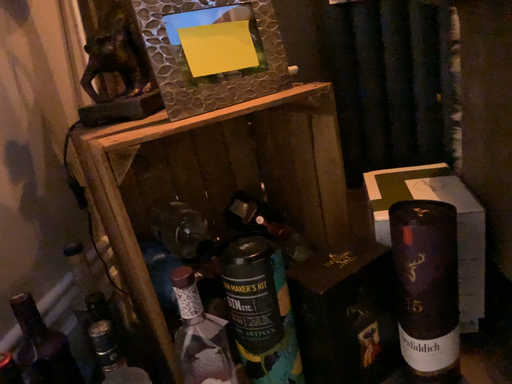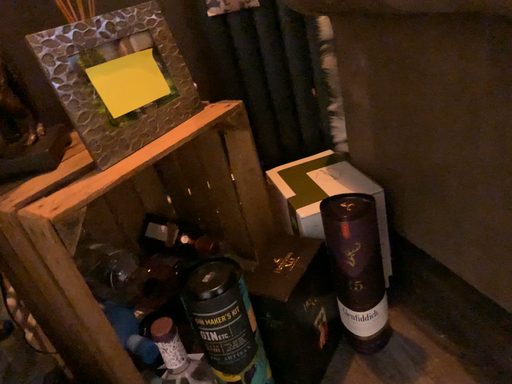
Question: Which way did the camera rotate in the video?

Choices:
 (A) rotated left
 (B) rotated right

Answer: (B)